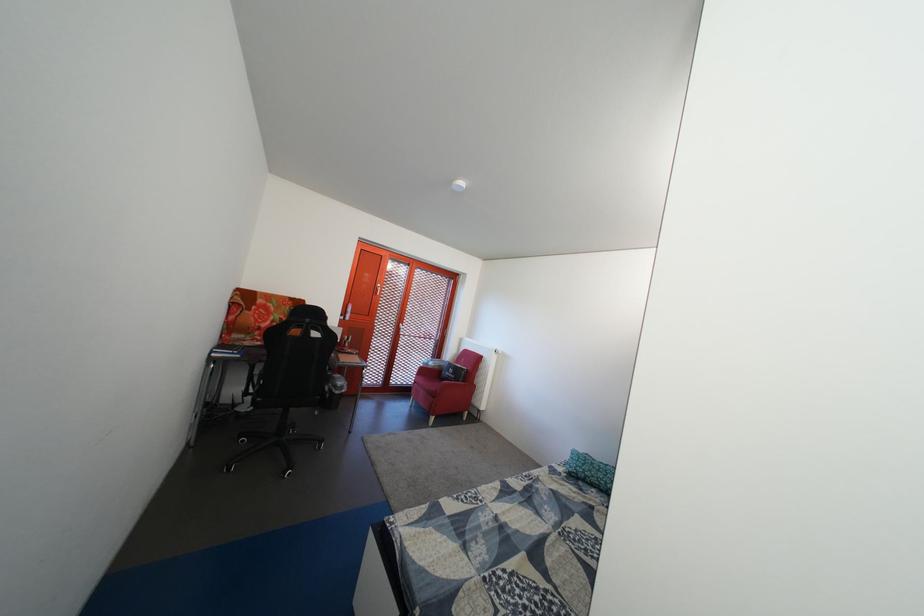
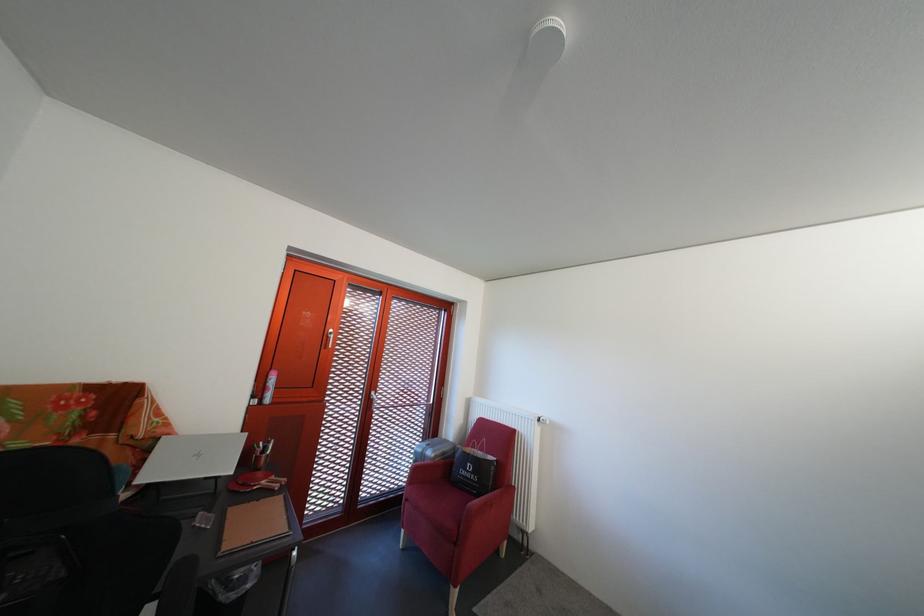
Question: I am providing you with two images of the same scene from different viewpoints. Please identify which objects are invisible in image2.

Choices:
 (A) silver laptop
 (B) small silver suitcase
 (C) chair sitting surface
 (D) none of these

Answer: (D)